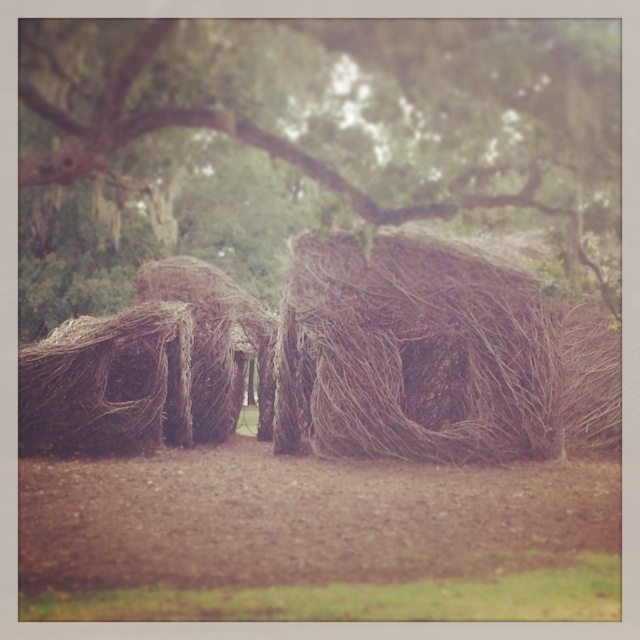
Is brown woven structure at center above brown woven hut at center?

Yes.

Is point (524, 124) behind point (490, 435)?

That is False.

Is point (202, 68) positioned behind point (548, 403)?

No.

This screenshot has width=640, height=640. What are the coordinates of `brown woven structure at center` in the screenshot? It's located at (340, 113).

Is brown woven hut at center smaller than brown woven basket at left?

No, brown woven hut at center is not smaller than brown woven basket at left.

Between point (522, 355) and point (58, 355), which one is positioned in front?

Point (522, 355)

I want to click on brown woven hut at center, so click(x=435, y=355).

Does brown woven structure at center appear under brown woven basket at left?

Actually, brown woven structure at center is above brown woven basket at left.

What do you see at coordinates (340, 113) in the screenshot? I see `brown woven structure at center` at bounding box center [340, 113].

Locate an element on the screen. Image resolution: width=640 pixels, height=640 pixels. brown woven structure at center is located at coordinates [x=340, y=113].